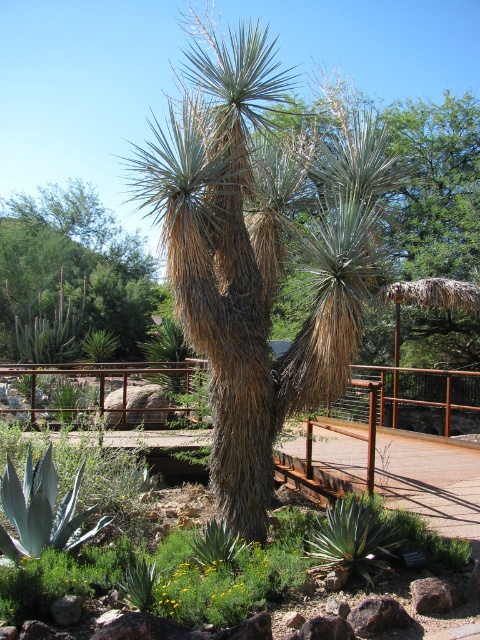
Is point (14, 250) closer to camera compared to point (437, 588)?

No, (14, 250) is further to viewer.

Where is `green leafy tree at center`? This screenshot has height=640, width=480. green leafy tree at center is located at coordinates (74, 264).

Image resolution: width=480 pixels, height=640 pixels. In order to click on green leafy tree at center in this screenshot , I will do `click(74, 264)`.

Is point (97, 230) behind point (317, 472)?

Yes, it is behind point (317, 472).

Can you confirm if green leafy tree at center is wider than green leafy plants at center?

Yes, green leafy tree at center is wider than green leafy plants at center.

Between point (112, 241) and point (356, 484), which one is positioned behind?

The point (112, 241) is behind.

At what (x,y) coordinates should I click in order to perform the action: click on green leafy tree at center. Please return your answer as a coordinate pair (x, y). This screenshot has width=480, height=640. Looking at the image, I should click on (74, 264).

Is green leafy plants at center bigger than gray rock at center?

Yes.

From the picture: Does green leafy plants at center have a lesser width compared to gray rock at center?

Correct, green leafy plants at center's width is less than gray rock at center's.

Between point (194, 438) and point (425, 579), which one is positioned behind?

The point (194, 438) is behind.

Identify the location of green leafy plants at center. The image size is (480, 640). (431, 481).